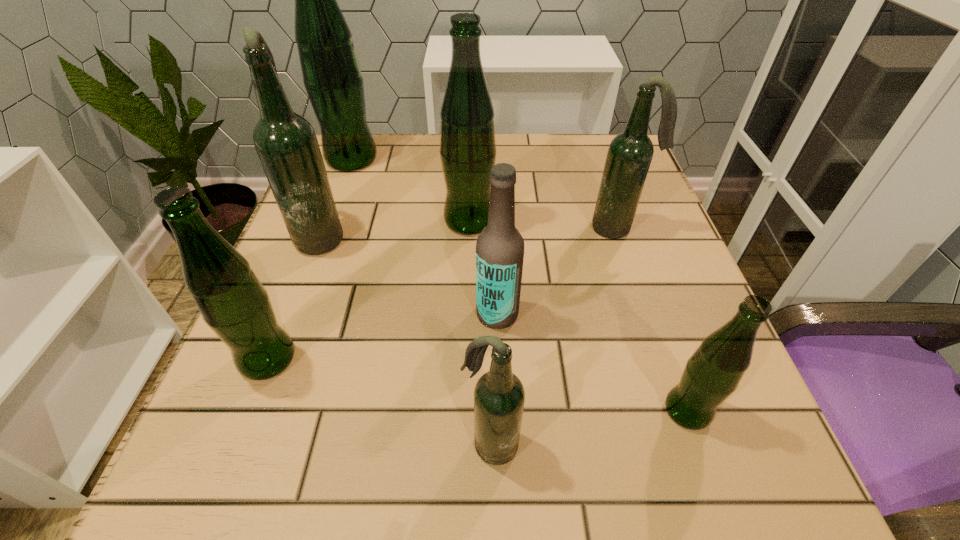
The height and width of the screenshot is (540, 960). What are the coordinates of `the farthest beer bottle` in the screenshot? It's located at (333, 80).

This screenshot has height=540, width=960. I want to click on the farthest green beer bottle, so click(x=333, y=80).

Locate an element on the screen. This screenshot has width=960, height=540. the third green beer bottle from left to right is located at coordinates (468, 149).

This screenshot has height=540, width=960. I want to click on the third smallest green beer bottle, so click(x=468, y=149).

This screenshot has height=540, width=960. In order to click on the biggest dark beer bottle in this screenshot , I will do `click(286, 143)`.

Identify the location of the second smallest dark beer bottle. (630, 153).

Where is `the sixth farthest beer bottle`? The width and height of the screenshot is (960, 540). the sixth farthest beer bottle is located at coordinates (232, 301).

This screenshot has height=540, width=960. Identify the location of the second smallest green beer bottle. pyautogui.click(x=232, y=301).

You are a GUI agent. You are given a task and a screenshot of the screen. Output one action in this format:
    pyautogui.click(x=<x>, y=<y>)
    Task: Click on the fourth nearest object
    Image resolution: width=960 pixels, height=540 pixels.
    Given the screenshot: What is the action you would take?
    pyautogui.click(x=500, y=247)

Image resolution: width=960 pixels, height=540 pixels. I want to click on the rightmost green beer bottle, so click(713, 372).